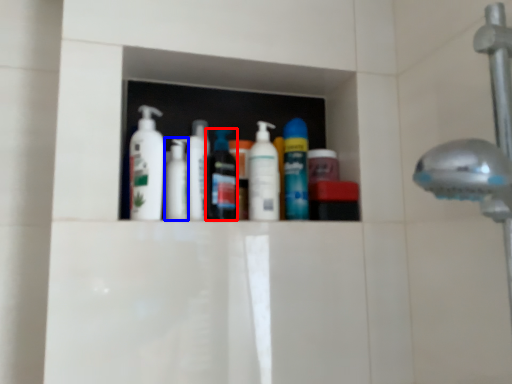
Question: Which of the following is the farthest to the observer, mouthwash (highlighted by a red box) or toiletry (highlighted by a blue box)?

Choices:
 (A) mouthwash
 (B) toiletry

Answer: (B)